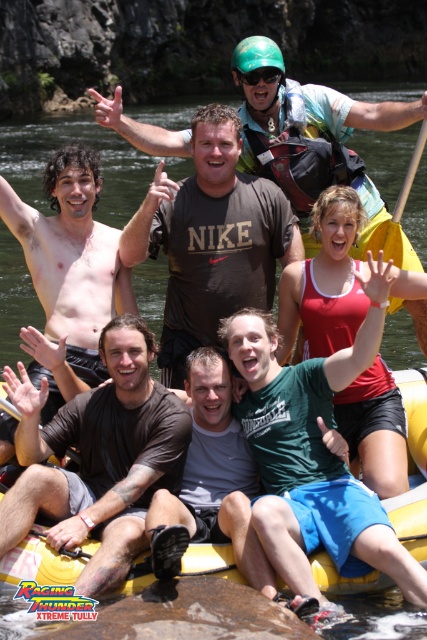
Can you confirm if brown cotton t-shirt at center is thinner than dark brown cotton t-shirt at center?

Indeed, brown cotton t-shirt at center has a lesser width compared to dark brown cotton t-shirt at center.

Which is behind, point (134, 353) or point (263, 214)?

The point (263, 214) is behind.

At what (x,y) coordinates should I click in order to perform the action: click on brown cotton t-shirt at center. Please return your answer as a coordinate pair (x, y). The width and height of the screenshot is (427, 640). Looking at the image, I should click on (98, 456).

Is green cotton shirt at center shorter than yellow rubber raft at lower center?

No.

Identify the location of green cotton shirt at center. Image resolution: width=427 pixels, height=640 pixels. (312, 451).

Which is in front, point (259, 400) or point (99, 600)?

Positioned in front is point (99, 600).

The image size is (427, 640). I want to click on green cotton shirt at center, so click(312, 451).

Which is above, yellow rubber raft at lower center or red matte tank top at center?

red matte tank top at center

Is yellow rubber raft at lower center bigger than red matte tank top at center?

Yes, yellow rubber raft at lower center is bigger than red matte tank top at center.

Which is behind, point (414, 636) or point (353, 276)?

The point (353, 276) is more distant.

In order to click on yellow rubber raft at lower center in this screenshot , I will do `click(236, 608)`.